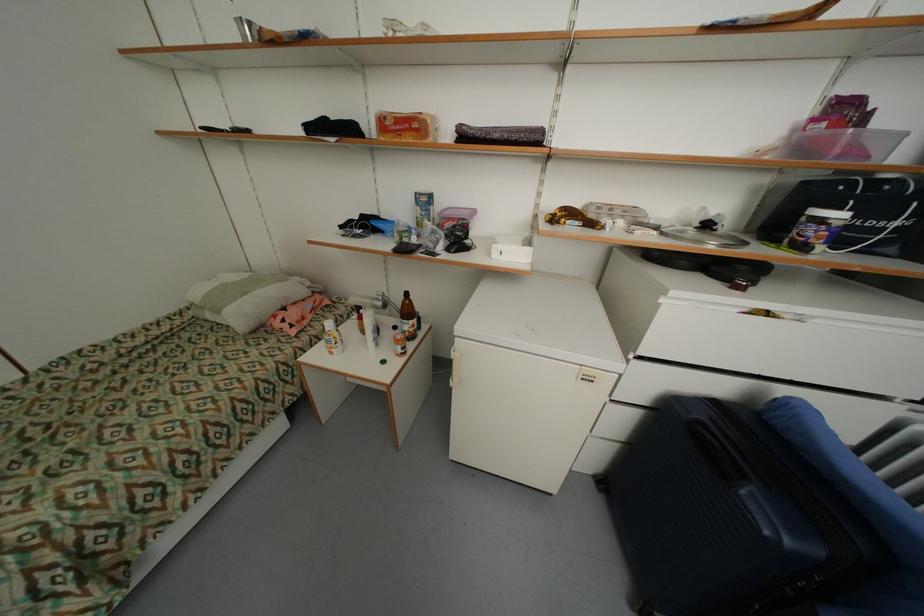
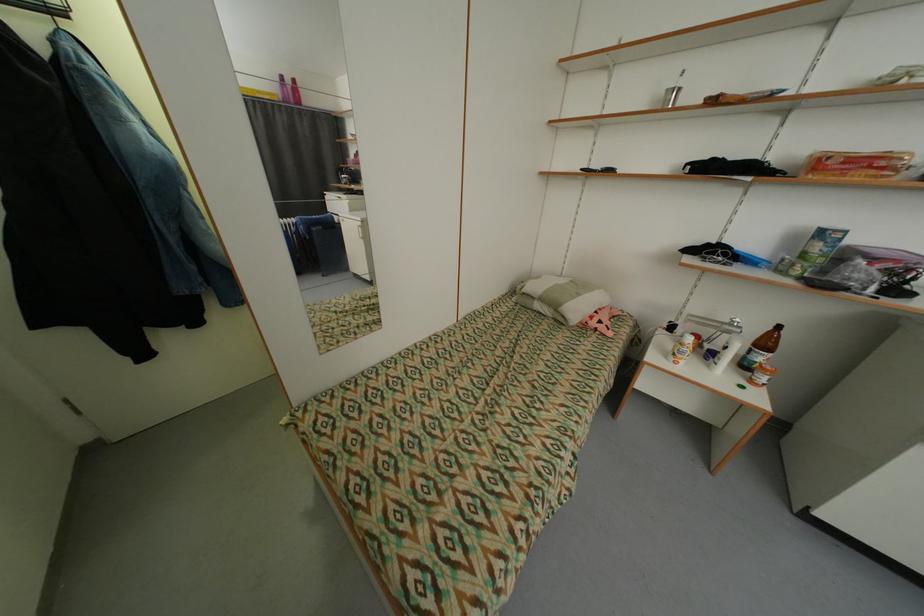
The point at (251,294) is marked in the first image. Where is the corresponding point in the second image?

(585, 296)